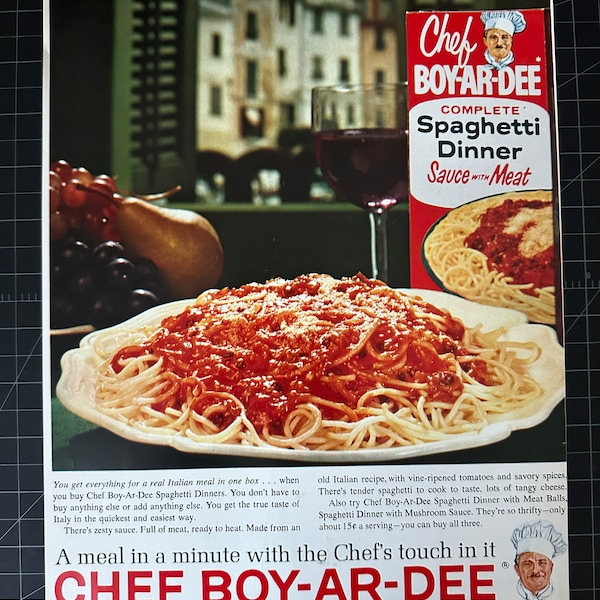
Where is `table`? This screenshot has height=600, width=600. table is located at coordinates (103, 446).